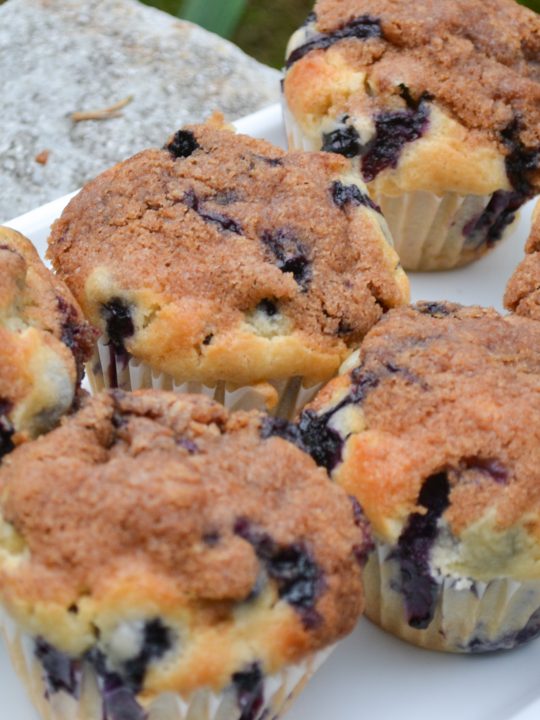
Where is `trash`? This screenshot has height=720, width=540. trash is located at coordinates point(116,104).